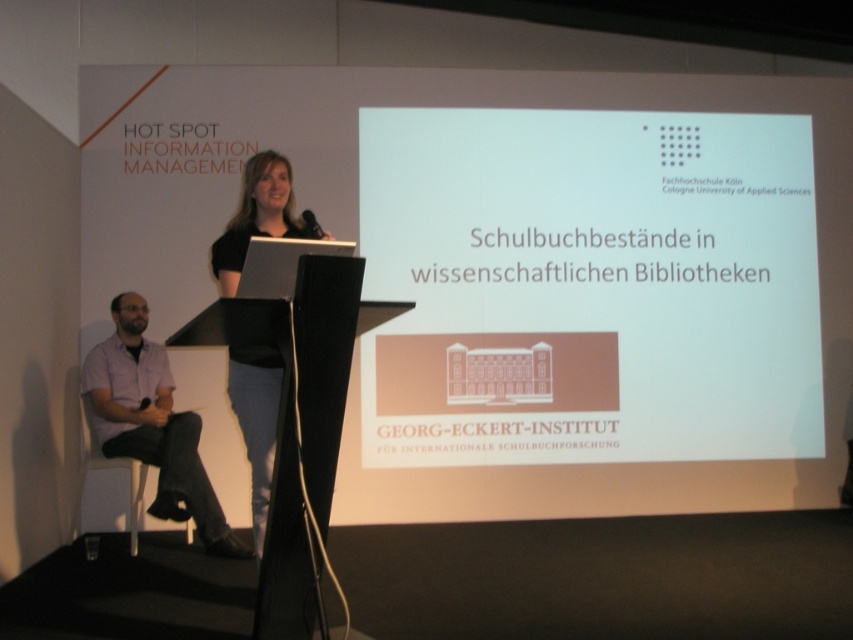
Is purple cotton shirt at lower left smaller than black matte laptop at center?

Incorrect, purple cotton shirt at lower left is not smaller in size than black matte laptop at center.

Between point (166, 458) and point (282, 156), which one is positioned in front?

Point (282, 156) is in front.

Identify the location of purple cotton shirt at lower left. (152, 424).

Does black matte laptop at center have a lesser height compared to matte black microphone at upper center?

No.

Between point (256, 376) and point (312, 224), which one is positioned in front?

Point (312, 224) is in front.

Locate an element on the screen. The height and width of the screenshot is (640, 853). black matte laptop at center is located at coordinates tap(256, 420).

Between purple cotton shirt at lower left and white plastic chair at lower left, which one has less height?

white plastic chair at lower left is shorter.

Can you confirm if purple cotton shirt at lower left is bigger than white plastic chair at lower left?

Yes, purple cotton shirt at lower left is bigger than white plastic chair at lower left.

Is point (244, 552) behind point (90, 428)?

No.

Identify the location of purple cotton shirt at lower left. The image size is (853, 640). (152, 424).